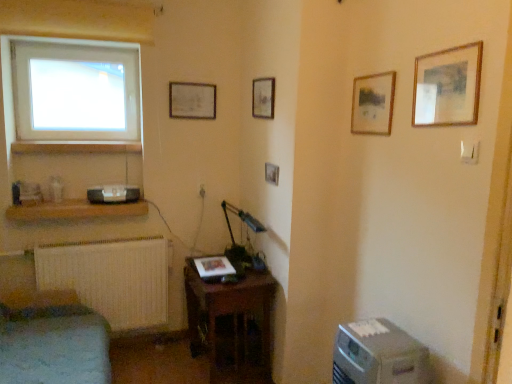
The height and width of the screenshot is (384, 512). What are the coordinates of `free space above metallic gray desktop computer at lower right (from a real-world perspective)` in the screenshot? It's located at (372, 334).